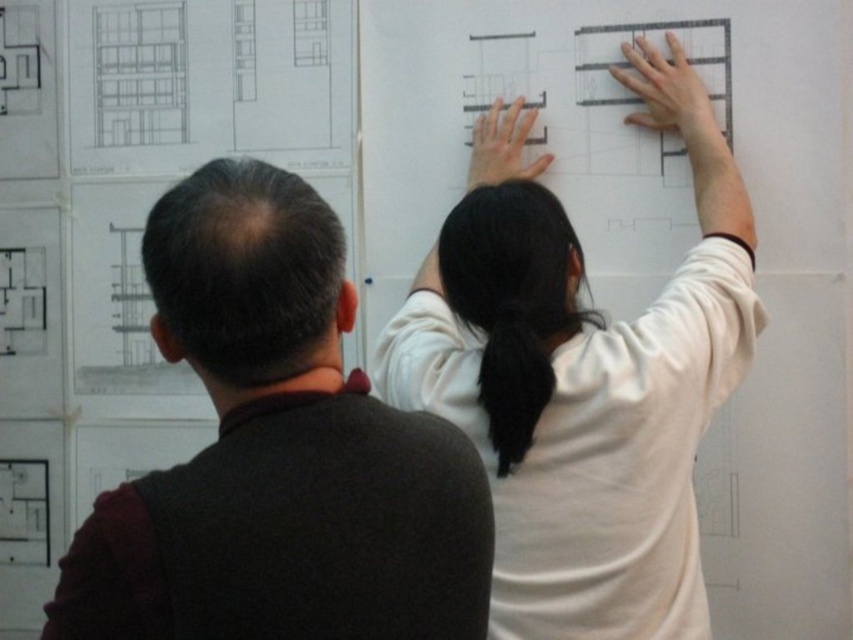
You are standing in front of the architectural blueprints and need to locate the dark brown sweater at left. Where exactly is it positioned relative to the blueprints?

The dark brown sweater at left is positioned at point 0.708 on the x axis and 0.326 on the y axis relative to the blueprints.

You are an architect standing at the center of the room. You need to determine the location of the dark brown sweater at left relative to the point marked at (277, 452). Is the sweater located to the left or right of this point?

The dark brown sweater at left is represented by point (277, 452), so it is exactly at that point.

You are an observer standing in front of the two people looking at blueprints. You need to determine which clothing item is shorter between the dark brown sweater at left and the white matte shirt at upper center. Which one is shorter?

The dark brown sweater at left is shorter than the white matte shirt at upper center.